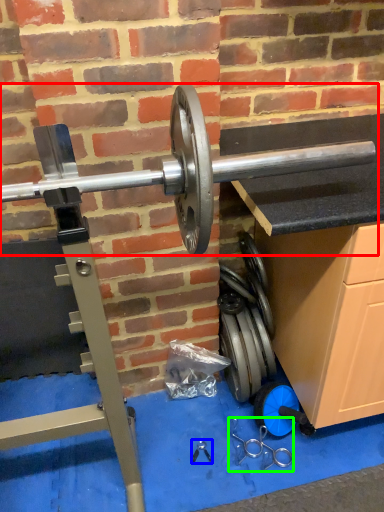
Question: Which is farther away from barbell (highlighted by a red box)? tool (highlighted by a blue box) or tool (highlighted by a green box)?

Choices:
 (A) tool
 (B) tool

Answer: (A)